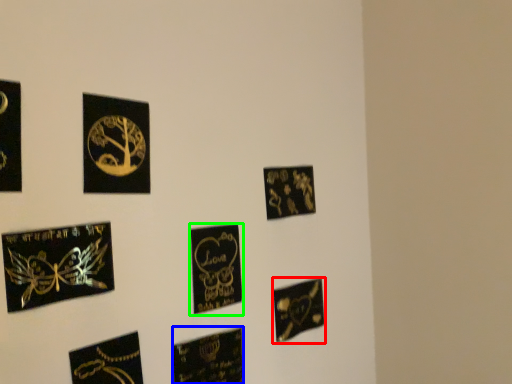
Question: Which is nearer to the picture frame (highlighted by a red box)? picture frame (highlighted by a blue box) or picture frame (highlighted by a green box).

Choices:
 (A) picture frame
 (B) picture frame

Answer: (A)